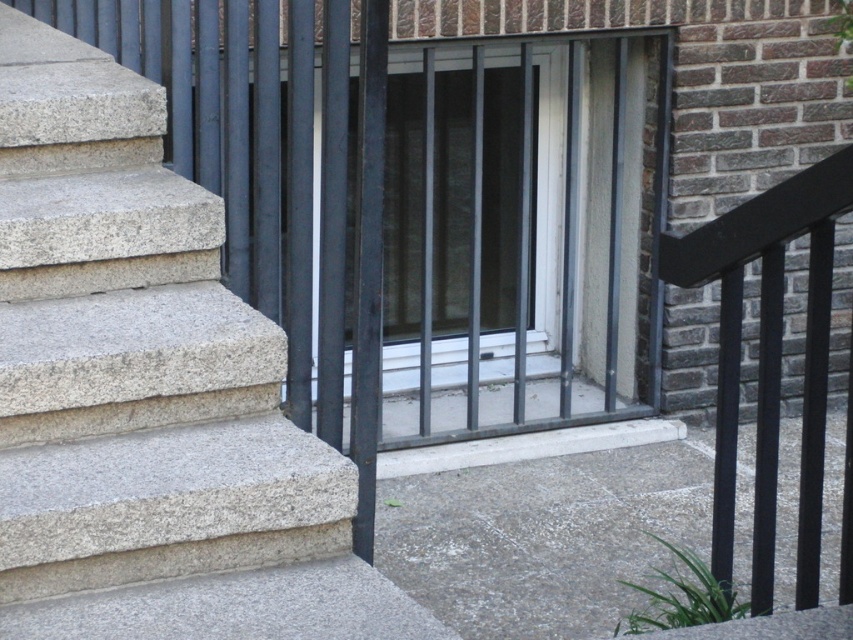
You are standing at the entrance of the residential building and want to reach the door. Based on the image, where are the smooth concrete steps at left located in terms of their 2D coordinates?

The smooth concrete steps at left are located at the 2D coordinates point (148, 392).

You are a delivery person trying to reach the clear glass door at center. The smooth concrete steps at left are in your way. Can you walk around them to reach the door?

The smooth concrete steps at left are positioned under the clear glass door at center, so you can walk around the steps to reach the door since they are below it and not blocking the path directly.

You are standing in front of the residential building and want to take a photo of the two points marked on the steps. Which point, point (160, 216) or point (421, 444), will appear larger in the photo?

Point (160, 216) will appear larger in the photo because it is closer to the camera than point (421, 444).